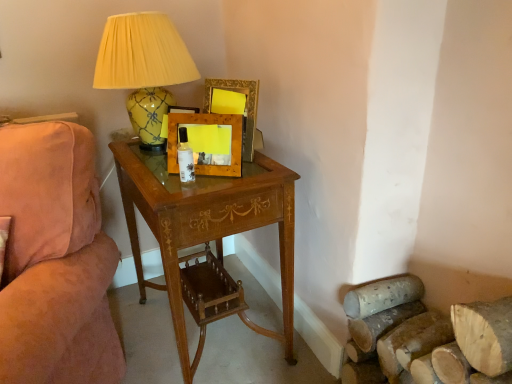
Question: Could you tell me if wooden desk at center is facing wooden picture frame at center, marked as the 2th picture frame in a back-to-front arrangement?

Choices:
 (A) yes
 (B) no

Answer: (B)

Question: Is wooden picture frame at center, marked as the 2th picture frame in a back-to-front arrangement, surrounded by wooden desk at center?

Choices:
 (A) no
 (B) yes

Answer: (A)

Question: From the image's perspective, is wooden desk at center on top of wooden picture frame at center, marked as the first picture frame in a front-to-back arrangement?

Choices:
 (A) no
 (B) yes

Answer: (A)

Question: Is wooden desk at center positioned beyond the bounds of wooden picture frame at center, marked as the 2th picture frame in a back-to-front arrangement?

Choices:
 (A) yes
 (B) no

Answer: (A)

Question: Is wooden desk at center to the left of wooden picture frame at center, marked as the 2th picture frame in a back-to-front arrangement, from the viewer's perspective?

Choices:
 (A) yes
 (B) no

Answer: (A)

Question: Relative to yellow glossy ceramic lamp at upper left, is wooden picture frame at center, marked as the 2th picture frame in a back-to-front arrangement, in front or behind?

Choices:
 (A) behind
 (B) front

Answer: (B)

Question: Considering the relative positions of wooden picture frame at center, marked as the first picture frame in a front-to-back arrangement, and yellow glossy ceramic lamp at upper left in the image provided, is wooden picture frame at center, marked as the first picture frame in a front-to-back arrangement, to the left or to the right of yellow glossy ceramic lamp at upper left?

Choices:
 (A) right
 (B) left

Answer: (A)

Question: Is wooden picture frame at center, marked as the first picture frame in a front-to-back arrangement, bigger or smaller than yellow glossy ceramic lamp at upper left?

Choices:
 (A) small
 (B) big

Answer: (A)

Question: From a real-world perspective, is wooden picture frame at center, marked as the first picture frame in a front-to-back arrangement, physically located above or below yellow glossy ceramic lamp at upper left?

Choices:
 (A) below
 (B) above

Answer: (A)

Question: From a real-world perspective, is yellow glossy ceramic lamp at upper left above or below wooden picture frame at center, marked as the first picture frame in a front-to-back arrangement?

Choices:
 (A) below
 (B) above

Answer: (B)

Question: Is point (129, 57) closer or farther from the camera than point (229, 114)?

Choices:
 (A) farther
 (B) closer

Answer: (A)

Question: Based on their sizes in the image, would you say yellow glossy ceramic lamp at upper left is bigger or smaller than wooden picture frame at center, marked as the first picture frame in a front-to-back arrangement?

Choices:
 (A) small
 (B) big

Answer: (B)

Question: Is yellow glossy ceramic lamp at upper left taller or shorter than wooden picture frame at center, marked as the 2th picture frame in a back-to-front arrangement?

Choices:
 (A) short
 (B) tall

Answer: (B)

Question: Is wooden desk at center inside the boundaries of yellow glossy ceramic lamp at upper left, or outside?

Choices:
 (A) outside
 (B) inside

Answer: (A)

Question: Is wooden desk at center in front of or behind yellow glossy ceramic lamp at upper left in the image?

Choices:
 (A) behind
 (B) front

Answer: (B)